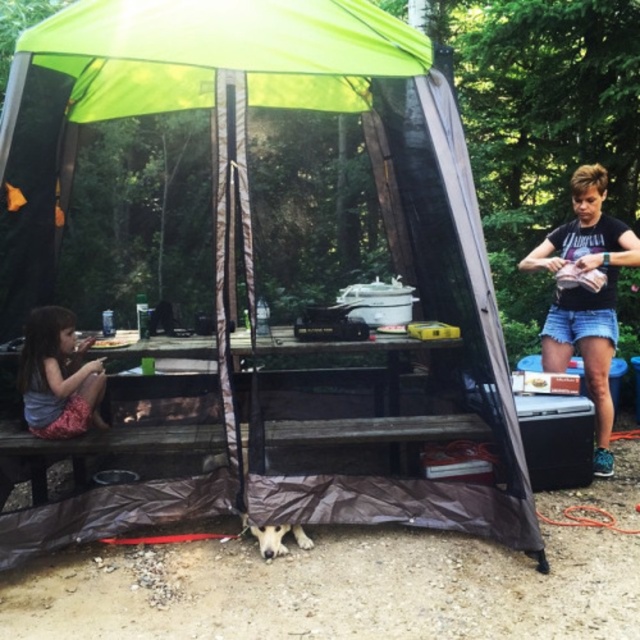
Between black denim shorts at right and matte pink dress at lower left, which one appears on the left side from the viewer's perspective?

matte pink dress at lower left is more to the left.

Between black denim shorts at right and matte pink dress at lower left, which one is positioned lower?

matte pink dress at lower left

Between point (570, 250) and point (100, 387), which one is positioned behind?

The point (570, 250) is more distant.

At what (x,y) coordinates should I click in order to perform the action: click on black denim shorts at right. Please return your answer as a coordinate pair (x, y). The width and height of the screenshot is (640, 640). Looking at the image, I should click on pyautogui.click(x=586, y=296).